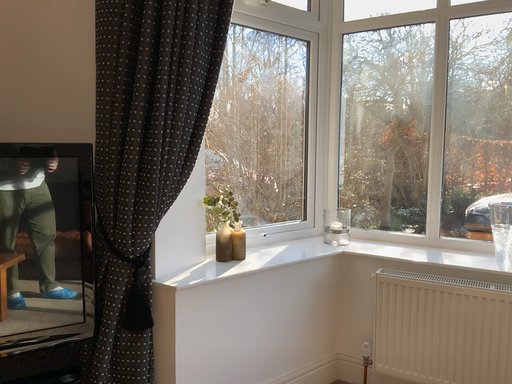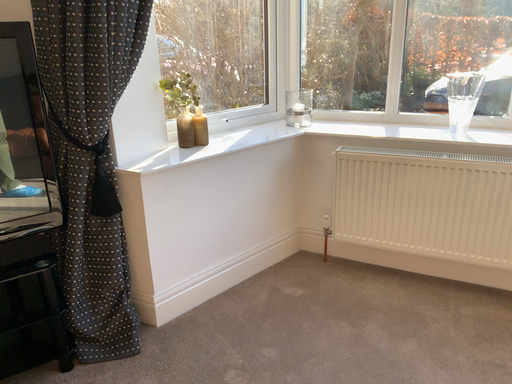
Question: Which way did the camera rotate in the video?

Choices:
 (A) rotated upward
 (B) rotated downward

Answer: (B)